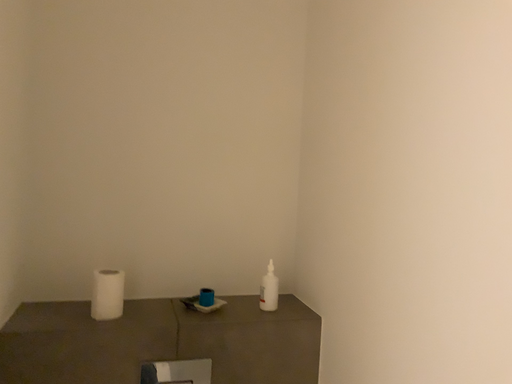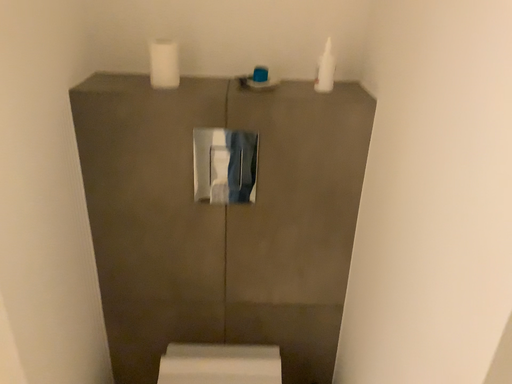
Question: How did the camera likely rotate when shooting the video?

Choices:
 (A) rotated left
 (B) rotated right

Answer: (A)